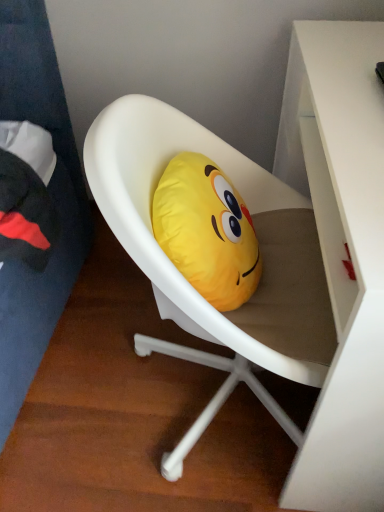
Question: Considering the relative positions of white glossy desk at upper right and yellow fabric emoji pillow at center in the image provided, is white glossy desk at upper right in front of yellow fabric emoji pillow at center?

Choices:
 (A) no
 (B) yes

Answer: (B)

Question: From the image's perspective, is white glossy desk at upper right on yellow fabric emoji pillow at center?

Choices:
 (A) no
 (B) yes

Answer: (A)

Question: Can you confirm if white glossy desk at upper right is positioned to the left of yellow fabric emoji pillow at center?

Choices:
 (A) no
 (B) yes

Answer: (A)

Question: From a real-world perspective, is white glossy desk at upper right physically above yellow fabric emoji pillow at center?

Choices:
 (A) no
 (B) yes

Answer: (A)

Question: Does white glossy desk at upper right have a smaller size compared to yellow fabric emoji pillow at center?

Choices:
 (A) yes
 (B) no

Answer: (B)

Question: Would you say white matte chair at center is to the left or to the right of yellow fabric emoji pillow at center in the picture?

Choices:
 (A) right
 (B) left

Answer: (A)

Question: Is white matte chair at center situated inside yellow fabric emoji pillow at center or outside?

Choices:
 (A) inside
 (B) outside

Answer: (B)

Question: In the image, is white matte chair at center positioned in front of or behind yellow fabric emoji pillow at center?

Choices:
 (A) front
 (B) behind

Answer: (A)

Question: Considering the positions of white matte chair at center and yellow fabric emoji pillow at center in the image, is white matte chair at center wider or thinner than yellow fabric emoji pillow at center?

Choices:
 (A) thin
 (B) wide

Answer: (B)

Question: Considering the positions of point (145, 129) and point (327, 231), is point (145, 129) closer or farther from the camera than point (327, 231)?

Choices:
 (A) farther
 (B) closer

Answer: (A)

Question: Considering their positions, is white matte chair at center located in front of or behind white glossy desk at upper right?

Choices:
 (A) behind
 (B) front

Answer: (A)

Question: Looking at their shapes, would you say white matte chair at center is wider or thinner than white glossy desk at upper right?

Choices:
 (A) thin
 (B) wide

Answer: (B)

Question: From a real-world perspective, is white matte chair at center physically located above or below white glossy desk at upper right?

Choices:
 (A) above
 (B) below

Answer: (A)

Question: Based on their sizes in the image, would you say yellow fabric emoji pillow at center is bigger or smaller than white matte chair at center?

Choices:
 (A) big
 (B) small

Answer: (B)

Question: From their relative heights in the image, would you say yellow fabric emoji pillow at center is taller or shorter than white matte chair at center?

Choices:
 (A) tall
 (B) short

Answer: (B)